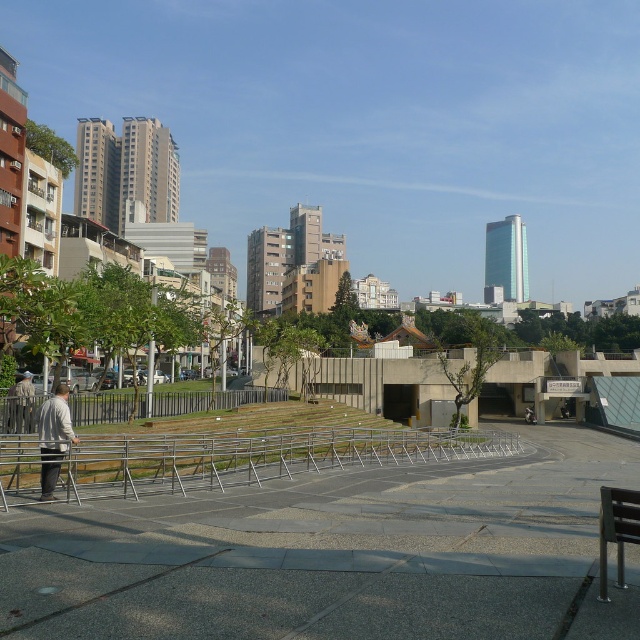
Question: Which point is farther to the camera?

Choices:
 (A) light brown leather jacket at lower left
 (B) silver metallic rail at center
 (C) light gray sweater at left
 (D) black metal bench at lower right

Answer: (A)

Question: Does silver metallic rail at center appear on the left side of light gray sweater at left?

Choices:
 (A) yes
 (B) no

Answer: (B)

Question: Which object appears closest to the camera in this image?

Choices:
 (A) black metal bench at lower right
 (B) light brown leather jacket at lower left
 (C) silver metallic rail at center

Answer: (A)

Question: Does silver metallic rail at center appear on the left side of black metal bench at lower right?

Choices:
 (A) no
 (B) yes

Answer: (B)

Question: Which object is positioned farthest from the light gray sweater at left?

Choices:
 (A) light brown leather jacket at lower left
 (B) black metal bench at lower right

Answer: (A)

Question: Does silver metallic rail at center have a greater width compared to light brown leather jacket at lower left?

Choices:
 (A) no
 (B) yes

Answer: (B)